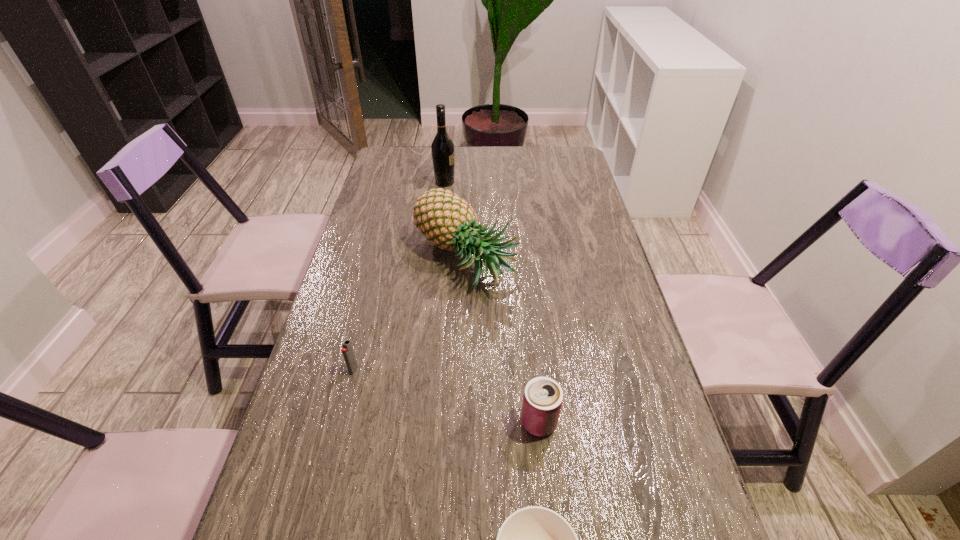
The height and width of the screenshot is (540, 960). What are the coordinates of `vacant region between the fourth farthest object and the wine bottle` in the screenshot? It's located at (492, 302).

Identify the location of empty location between the second nearest object and the fourth tallest object. The width and height of the screenshot is (960, 540). 446,396.

The height and width of the screenshot is (540, 960). In order to click on unoccupied area between the fourth nearest object and the leftmost object in this screenshot , I will do `click(410, 315)`.

The width and height of the screenshot is (960, 540). In order to click on free area in between the tallest object and the third nearest object in this screenshot , I will do `click(399, 276)`.

Where is `object identified as the second closest to the soup bowl`? object identified as the second closest to the soup bowl is located at coordinates (347, 350).

Where is `object identified as the second closest to the second farthest object`? Image resolution: width=960 pixels, height=540 pixels. object identified as the second closest to the second farthest object is located at coordinates (347, 350).

Locate an element on the screen. The image size is (960, 540). vacant space that satisfies the following two spatial constraints: 1. on the label of the second tallest object; 2. on the right side of the tallest object is located at coordinates point(437,259).

The height and width of the screenshot is (540, 960). Identify the location of vacant space that satisfies the following two spatial constraints: 1. on the label of the can; 2. on the right side of the farthest object. (419, 422).

This screenshot has height=540, width=960. Identify the location of vacant space that satisfies the following two spatial constraints: 1. on the back side of the can; 2. on the label of the tallest object. (514, 182).